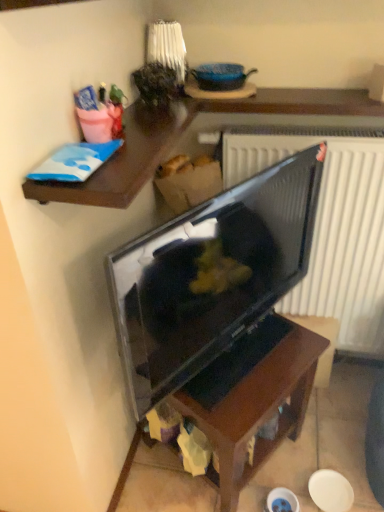
Question: Does wooden shelf at upper left contain dark wood table at center?

Choices:
 (A) no
 (B) yes

Answer: (A)

Question: Can you confirm if wooden shelf at upper left is bigger than dark wood table at center?

Choices:
 (A) yes
 (B) no

Answer: (B)

Question: Does wooden shelf at upper left have a greater height compared to dark wood table at center?

Choices:
 (A) yes
 (B) no

Answer: (B)

Question: From the image's perspective, is wooden shelf at upper left beneath dark wood table at center?

Choices:
 (A) no
 (B) yes

Answer: (A)

Question: Can we say wooden shelf at upper left lies outside dark wood table at center?

Choices:
 (A) no
 (B) yes

Answer: (B)

Question: In terms of width, does wooden shelf at upper left look wider or thinner when compared to dark wood table at center?

Choices:
 (A) thin
 (B) wide

Answer: (B)

Question: Relative to dark wood table at center, is wooden shelf at upper left in front or behind?

Choices:
 (A) behind
 (B) front

Answer: (B)

Question: Is wooden shelf at upper left situated inside dark wood table at center or outside?

Choices:
 (A) inside
 (B) outside

Answer: (B)

Question: From their relative heights in the image, would you say wooden shelf at upper left is taller or shorter than dark wood table at center?

Choices:
 (A) short
 (B) tall

Answer: (A)

Question: From a real-world perspective, is matte black tv at center physically located above or below dark wood table at center?

Choices:
 (A) above
 (B) below

Answer: (A)

Question: Is point (175, 265) closer or farther from the camera than point (175, 394)?

Choices:
 (A) farther
 (B) closer

Answer: (B)

Question: Would you say matte black tv at center is to the left or to the right of dark wood table at center in the picture?

Choices:
 (A) left
 (B) right

Answer: (A)

Question: Would you say matte black tv at center is inside or outside dark wood table at center?

Choices:
 (A) inside
 (B) outside

Answer: (B)

Question: Considering their positions, is dark wood table at center located in front of or behind matte black tv at center?

Choices:
 (A) front
 (B) behind

Answer: (B)

Question: Would you say dark wood table at center is to the left or to the right of matte black tv at center in the picture?

Choices:
 (A) left
 (B) right

Answer: (B)